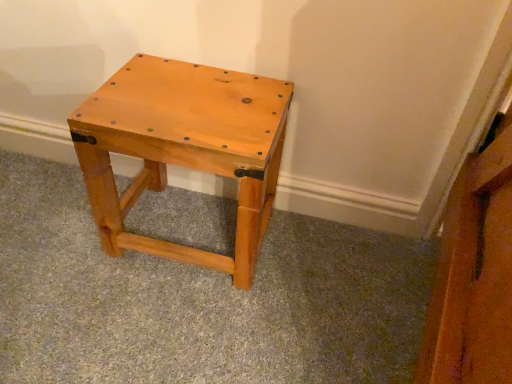
Identify the location of free space on the front side of natural wood stool at center. (169, 322).